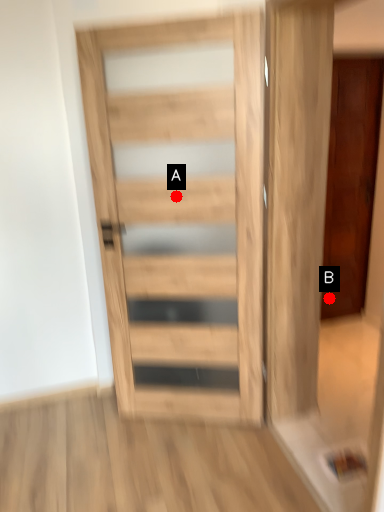
Question: Two points are circled on the image, labeled by A and B beside each circle. Which point is closer to the camera?

Choices:
 (A) A is closer
 (B) B is closer

Answer: (A)